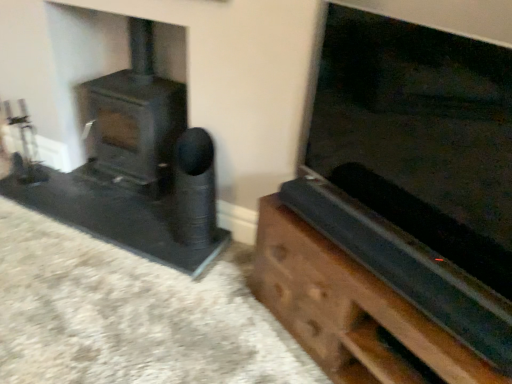
Find the location of a particular element. Image resolution: width=512 pixels, height=384 pixels. blank space situated above matte black wood burning stove at left (from a real-world perspective) is located at coordinates (131, 89).